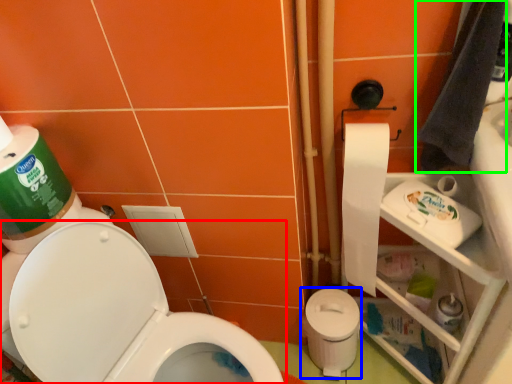
Question: Considering the real-world distances, which object is farthest from toilet (highlighted by a red box)? potty (highlighted by a blue box) or hand towel (highlighted by a green box)?

Choices:
 (A) potty
 (B) hand towel

Answer: (B)